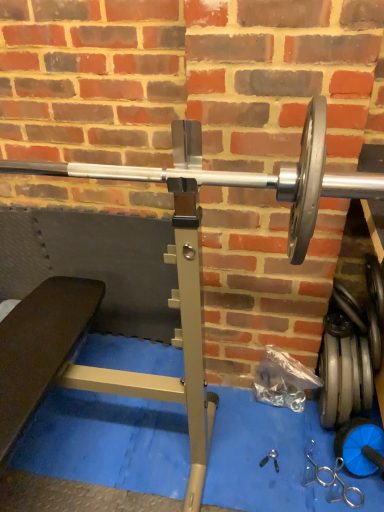
Question: Does silver metallic dumbbell at lower right, the second dumbbell ordered from the bottom, have a larger size compared to blue rubber dumbbell at lower right, the second dumbbell viewed from the top?

Choices:
 (A) no
 (B) yes

Answer: (B)

Question: From the image's perspective, is silver metallic dumbbell at lower right, placed as the first dumbbell when sorted from top to bottom, located beneath blue rubber dumbbell at lower right, the second dumbbell viewed from the top?

Choices:
 (A) yes
 (B) no

Answer: (B)

Question: Is silver metallic dumbbell at lower right, the second dumbbell ordered from the bottom, positioned before blue rubber dumbbell at lower right, the second dumbbell viewed from the top?

Choices:
 (A) yes
 (B) no

Answer: (B)

Question: From a real-world perspective, is silver metallic dumbbell at lower right, placed as the first dumbbell when sorted from top to bottom, positioned over blue rubber dumbbell at lower right, the second dumbbell viewed from the top, based on gravity?

Choices:
 (A) yes
 (B) no

Answer: (A)

Question: Is blue rubber dumbbell at lower right, arranged as the first dumbbell when ordered from the bottom, inside silver metallic dumbbell at lower right, the second dumbbell ordered from the bottom?

Choices:
 (A) no
 (B) yes

Answer: (A)

Question: Considering the relative positions of blue rubber dumbbell at lower right, the second dumbbell viewed from the top, and silver metallic barbell at center in the image provided, is blue rubber dumbbell at lower right, the second dumbbell viewed from the top, to the left or to the right of silver metallic barbell at center?

Choices:
 (A) right
 (B) left

Answer: (A)

Question: Is point (357, 428) closer or farther from the camera than point (314, 220)?

Choices:
 (A) closer
 (B) farther

Answer: (B)

Question: Considering their positions, is blue rubber dumbbell at lower right, arranged as the first dumbbell when ordered from the bottom, located in front of or behind silver metallic barbell at center?

Choices:
 (A) front
 (B) behind

Answer: (B)

Question: From their relative heights in the image, would you say blue rubber dumbbell at lower right, arranged as the first dumbbell when ordered from the bottom, is taller or shorter than silver metallic barbell at center?

Choices:
 (A) short
 (B) tall

Answer: (A)

Question: From a real-world perspective, is silver metallic barbell at center physically located above or below silver metallic dumbbell at lower right, placed as the first dumbbell when sorted from top to bottom?

Choices:
 (A) above
 (B) below

Answer: (A)

Question: In terms of height, does silver metallic barbell at center look taller or shorter compared to silver metallic dumbbell at lower right, placed as the first dumbbell when sorted from top to bottom?

Choices:
 (A) short
 (B) tall

Answer: (A)

Question: Is silver metallic barbell at center inside the boundaries of silver metallic dumbbell at lower right, the second dumbbell ordered from the bottom, or outside?

Choices:
 (A) inside
 (B) outside

Answer: (B)

Question: In the image, is silver metallic barbell at center positioned in front of or behind silver metallic dumbbell at lower right, placed as the first dumbbell when sorted from top to bottom?

Choices:
 (A) front
 (B) behind

Answer: (A)

Question: From their relative heights in the image, would you say blue rubber dumbbell at lower right, arranged as the first dumbbell when ordered from the bottom, is taller or shorter than silver metallic dumbbell at lower right, placed as the first dumbbell when sorted from top to bottom?

Choices:
 (A) short
 (B) tall

Answer: (A)

Question: In the image, is blue rubber dumbbell at lower right, arranged as the first dumbbell when ordered from the bottom, positioned in front of or behind silver metallic dumbbell at lower right, the second dumbbell ordered from the bottom?

Choices:
 (A) front
 (B) behind

Answer: (A)